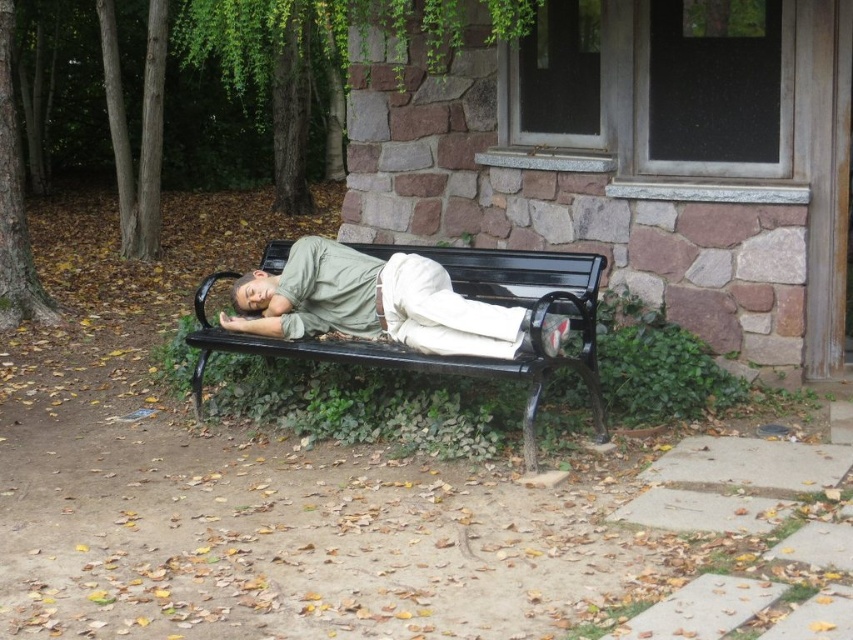
Is green matte shirt at center smaller than black metal bench at center?

Yes.

Is point (520, 326) farther from camera compared to point (270, 349)?

No.

The image size is (853, 640). What do you see at coordinates (373, 301) in the screenshot? I see `green matte shirt at center` at bounding box center [373, 301].

You are a GUI agent. You are given a task and a screenshot of the screen. Output one action in this format:
    pyautogui.click(x=<x>, y=<y>)
    Task: Click on the green matte shirt at center
    The height and width of the screenshot is (640, 853).
    Given the screenshot: What is the action you would take?
    pyautogui.click(x=373, y=301)